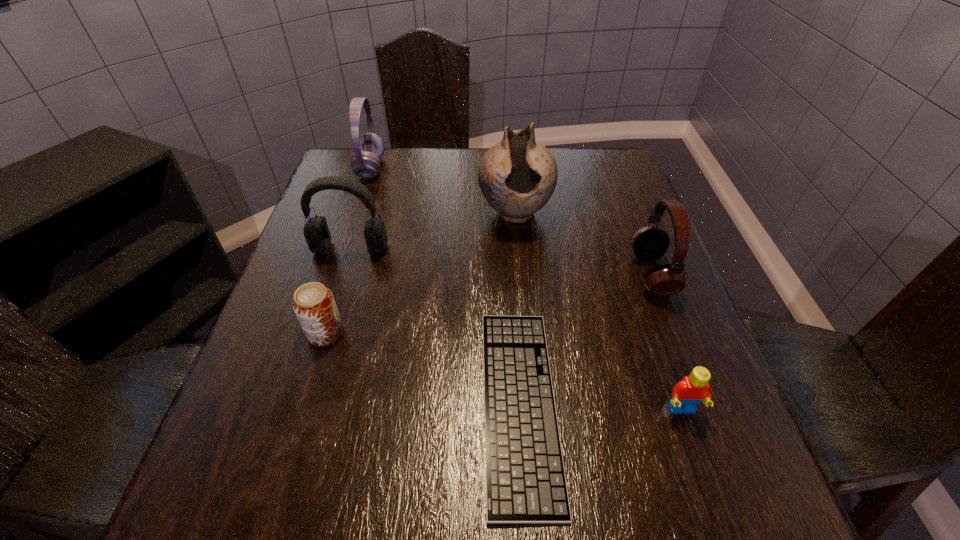
At what (x,y) coordinates should I click in order to perform the action: click on object positioned at the far left corner. Please return your answer as a coordinate pair (x, y). The width and height of the screenshot is (960, 540). Looking at the image, I should click on (369, 148).

In the image, there is a desktop. In order to click on vacant space at the far edge in this screenshot , I will do `click(482, 149)`.

Locate an element on the screen. The width and height of the screenshot is (960, 540). vacant space at the left edge is located at coordinates point(250,393).

This screenshot has width=960, height=540. Find the location of `vacant space at the right edge of the desktop`. vacant space at the right edge of the desktop is located at coordinates (589, 233).

Find the location of a particular element. vacant space at the far right corner of the desktop is located at coordinates (622, 165).

The height and width of the screenshot is (540, 960). What are the coordinates of `vacant region at the near right corner of the desktop` in the screenshot? It's located at (743, 485).

In order to click on free space between the Lego and the pottery in this screenshot , I will do `click(598, 312)`.

This screenshot has width=960, height=540. What are the coordinates of `vacant space that's between the beer can and the rightmost headset` in the screenshot? It's located at (489, 303).

The height and width of the screenshot is (540, 960). In order to click on free spot between the Lego and the pottery in this screenshot , I will do `click(598, 312)`.

Find the location of a particular element. The width and height of the screenshot is (960, 540). free space between the pottery and the rightmost headset is located at coordinates (584, 244).